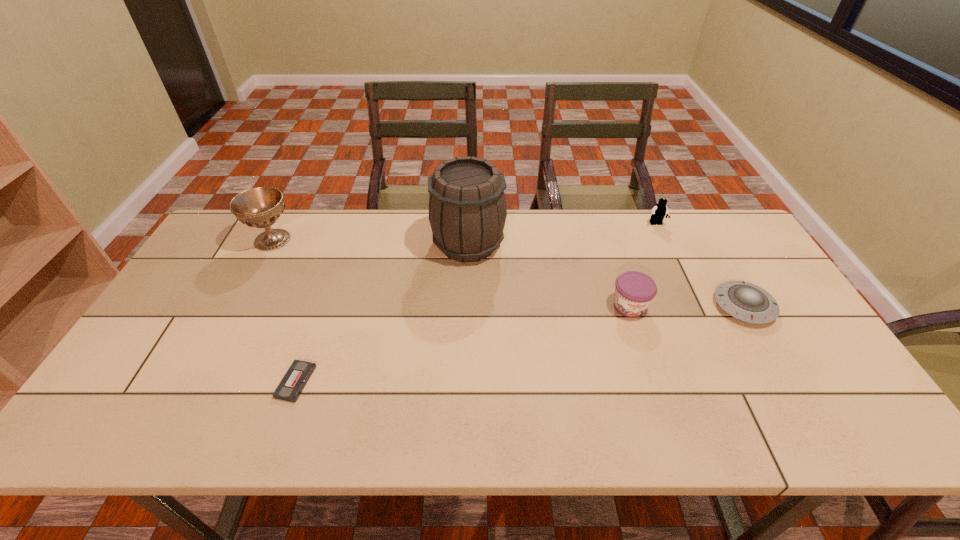
Where is `the tallest object`? This screenshot has height=540, width=960. the tallest object is located at coordinates (467, 209).

I want to click on wine bucket, so click(x=467, y=209).

Identify the location of the leftmost object. (260, 207).

Where is `the fifth shortest object`? the fifth shortest object is located at coordinates (260, 207).

Identify the location of Lego. pos(660,210).

Image resolution: width=960 pixels, height=540 pixels. Identify the location of jam. (634, 291).

Identify the location of saucer. This screenshot has height=540, width=960. tap(747, 302).

The image size is (960, 540). In order to click on the second shortest object in this screenshot , I will do `click(747, 302)`.

Locate an element on the screen. This screenshot has width=960, height=540. the fifth object from right to left is located at coordinates (292, 384).

You are a GUI agent. You are given a task and a screenshot of the screen. Output one action in this format:
    pyautogui.click(x=<x>, y=<y>)
    Task: Click on the videotape
    
    Given the screenshot: What is the action you would take?
    pyautogui.click(x=292, y=384)